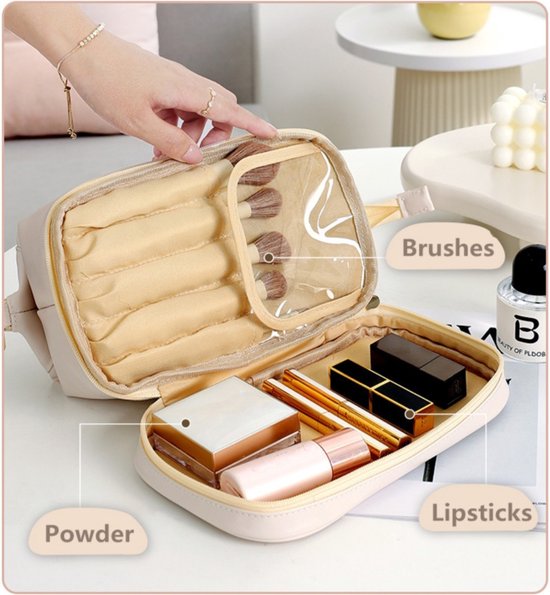
Identify the location of makeup brushes. (258, 173), (256, 200), (264, 238), (264, 273).